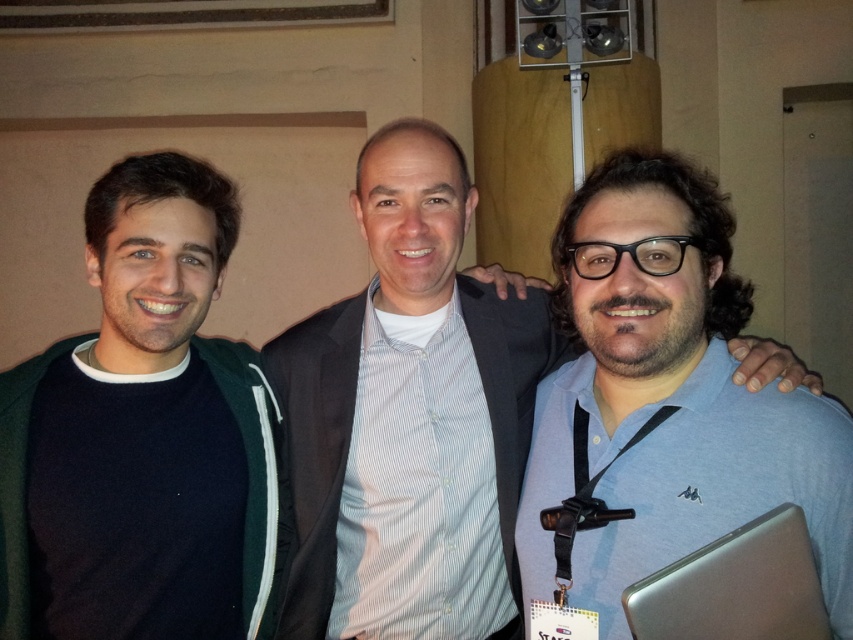
You are standing in front of the group of three people and want to determine which of the two points, point (x=270, y=435) or point (x=682, y=424), is closer to you. Based on the spatial relationship between these points, which one is nearer?

Point (x=270, y=435) is further to the viewer than point (x=682, y=424). Wait, no, the description says the first point is further to the viewer than the second. So the answer should be that point (x=270, y=435) is closer to you because it is further to the viewer. Hmm, maybe I need to clarify. Wait, the description says point A is further to the viewer than point B, so point A is closer to the observer. Therefore, the answer is point (x=270, y=435) is nearer.

Based on the scene description, which object is positioned to the left of the other between the dark green sweater at left and the blue fabric shirt at right?

The dark green sweater at left is positioned to the left of the blue fabric shirt at right.